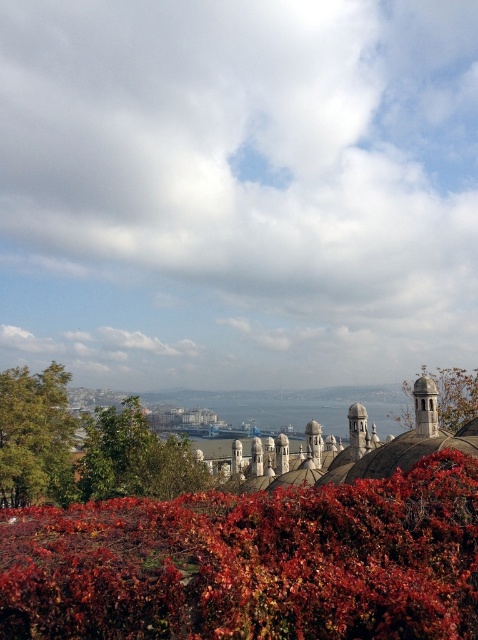
Is point (314, 547) in front of point (438, 419)?

Yes, point (314, 547) is closer to viewer.

This screenshot has height=640, width=478. Identify the location of leather-like red foliage at center. (252, 563).

Does green leafy tree at upper left have a greater height compared to green leafy tree at lower left?

Indeed, green leafy tree at upper left has a greater height compared to green leafy tree at lower left.

Between green leafy tree at upper left and green leafy tree at lower left, which one appears on the left side from the viewer's perspective?

Positioned to the left is green leafy tree at upper left.

Between point (24, 385) and point (189, 468), which one is positioned behind?

Point (24, 385)

Where is `green leafy tree at upper left`? green leafy tree at upper left is located at coordinates (34, 436).

The width and height of the screenshot is (478, 640). I want to click on green leafy tree at lower left, so click(x=134, y=458).

Is point (134, 480) farther from camera compared to point (475, 376)?

No, (134, 480) is in front of (475, 376).

Who is more distant from viewer, (203, 472) or (444, 413)?

The point (444, 413) is more distant.

Image resolution: width=478 pixels, height=640 pixels. I want to click on green leafy tree at lower left, so (134, 458).